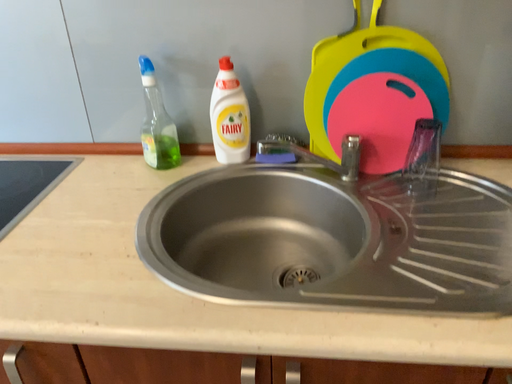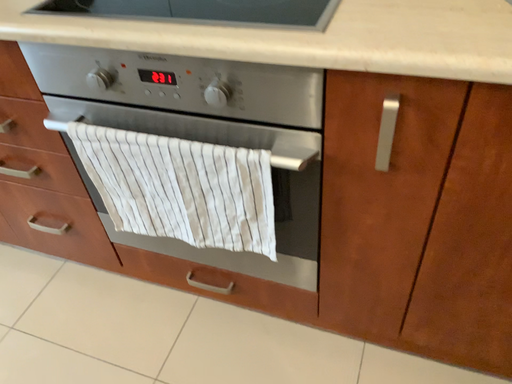
Question: Which way did the camera rotate in the video?

Choices:
 (A) rotated left
 (B) rotated right

Answer: (A)